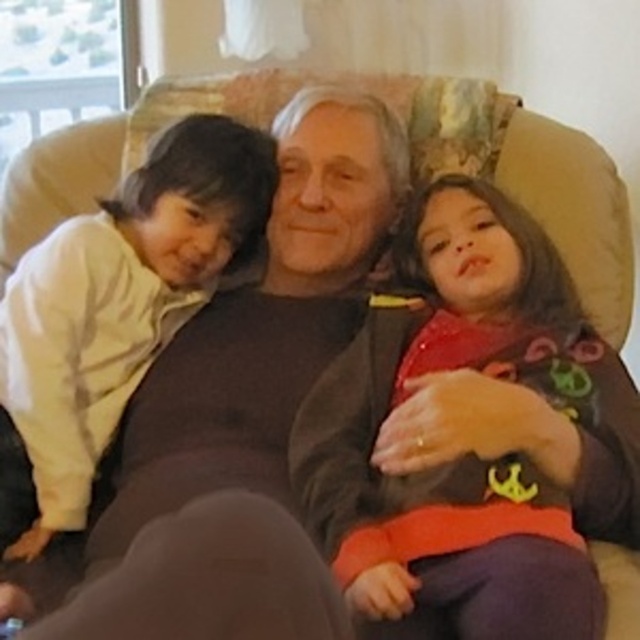
Question: Which object appears closest to the camera in this image?

Choices:
 (A) matte red sweater at center
 (B) light yellow fleece at left

Answer: (A)

Question: Does matte red sweater at center come in front of light yellow fleece at left?

Choices:
 (A) yes
 (B) no

Answer: (A)

Question: Which of the following is the farthest from the observer?

Choices:
 (A) light yellow fleece at left
 (B) matte red sweater at center

Answer: (A)

Question: Among these points, which one is farthest from the camera?

Choices:
 (A) (33, 490)
 (B) (454, 330)

Answer: (B)

Question: Does matte red sweater at center come in front of light yellow fleece at left?

Choices:
 (A) yes
 (B) no

Answer: (A)

Question: Can you confirm if matte red sweater at center is positioned to the left of light yellow fleece at left?

Choices:
 (A) yes
 (B) no

Answer: (B)